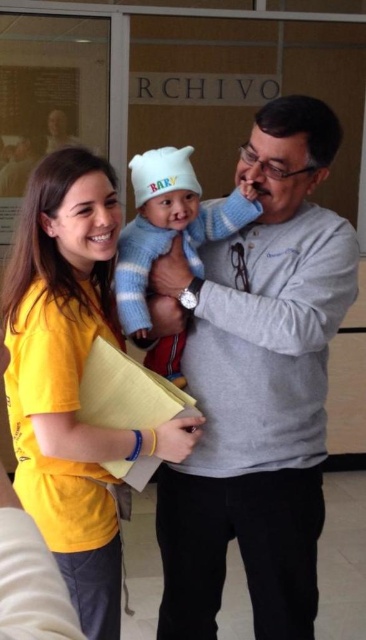
Question: Is gray cotton sweater at center above yellow fabric shirt at center?

Choices:
 (A) no
 (B) yes

Answer: (A)

Question: Which of the following is the closest to the observer?

Choices:
 (A) (269, 406)
 (B) (133, 323)

Answer: (B)

Question: Is gray cotton sweater at center further to camera compared to yellow fabric shirt at center?

Choices:
 (A) yes
 (B) no

Answer: (A)

Question: Which object is the closest to the yellow fabric shirt at center?

Choices:
 (A) gray cotton sweater at center
 (B) blue striped sweater at center

Answer: (B)

Question: Among these objects, which one is farthest from the camera?

Choices:
 (A) blue striped sweater at center
 (B) gray cotton sweater at center

Answer: (A)

Question: Does gray cotton sweater at center appear under blue striped sweater at center?

Choices:
 (A) no
 (B) yes

Answer: (B)